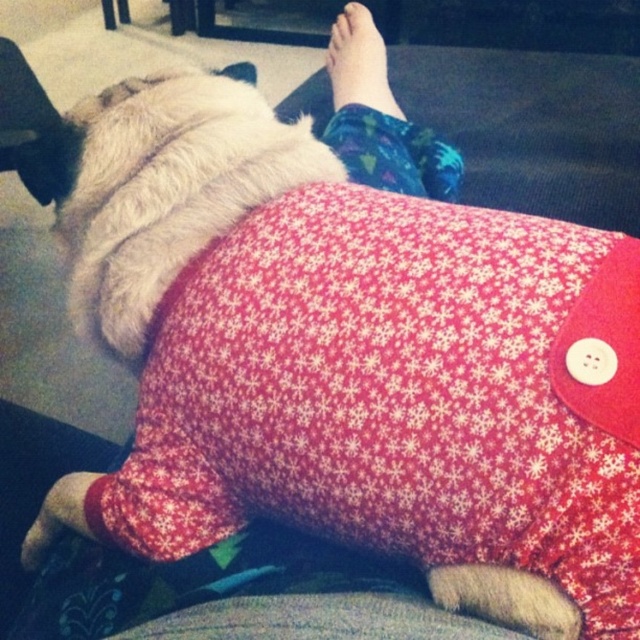
Question: Which of the following is the farthest from the observer?

Choices:
 (A) (403, 113)
 (B) (488, 260)

Answer: (A)

Question: Can you confirm if red fabric pillow at center is positioned below skinny bare foot at upper center?

Choices:
 (A) no
 (B) yes

Answer: (B)

Question: Is red fabric pillow at center positioned at the back of skinny bare foot at upper center?

Choices:
 (A) no
 (B) yes

Answer: (A)

Question: Can you confirm if red fabric pillow at center is smaller than skinny bare foot at upper center?

Choices:
 (A) yes
 (B) no

Answer: (B)